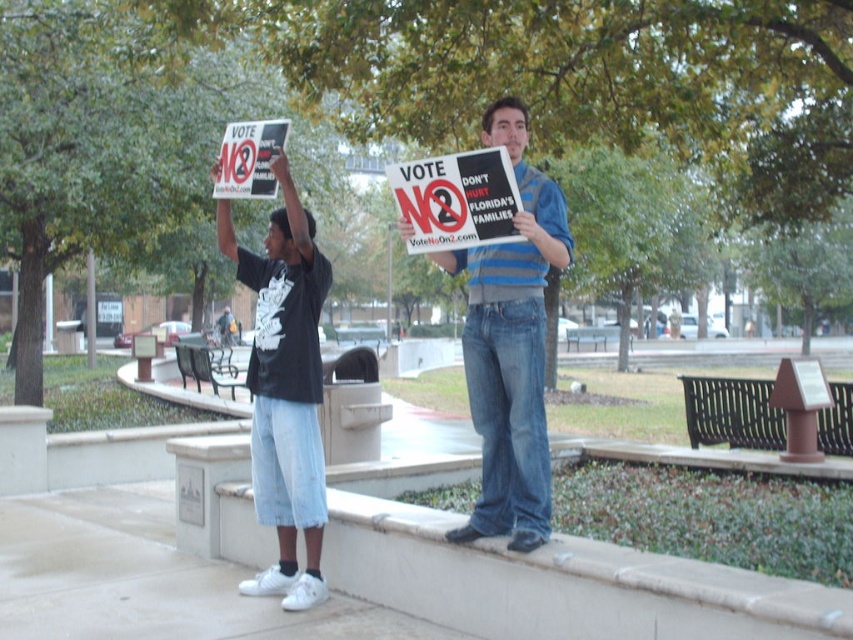
You are a photographer trying to capture a photo of the blue striped shirt at center and the white concrete curb at lower center. Based on their positions, which object should you focus on first to ensure both are in frame?

The blue striped shirt at center should be focused on first since the white concrete curb at lower center is to the right of it, allowing you to adjust the frame to include both.

You are a delivery drone that needs to land on the white concrete curb at lower center. The landing coordinates must be within a 0.1 radius of the curb. Can you land safely?

The white concrete curb at lower center is located at point (561, 582). Since the landing coordinates must be within a 0.1 radius of the curb, the drone can safely land there as long as it targets the exact coordinates provided.